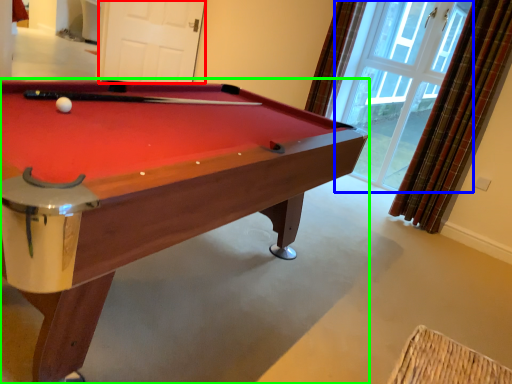
Question: Based on their relative distances, which object is farther from screen door (highlighted by a red box)? Choose from window (highlighted by a blue box) and billiard table (highlighted by a green box).

Choices:
 (A) window
 (B) billiard table

Answer: (B)